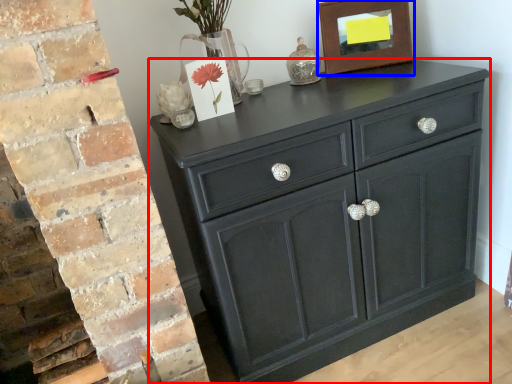
Question: Which object appears closest to the camera in this image, chest of drawers (highlighted by a red box) or picture frame (highlighted by a blue box)?

Choices:
 (A) chest of drawers
 (B) picture frame

Answer: (A)